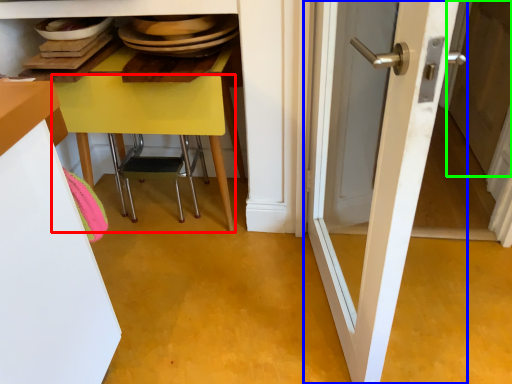
Question: Estimate the real-world distances between objects in this image. Which object is farther from table (highlighted by a red box), door (highlighted by a blue box) or screen door (highlighted by a green box)?

Choices:
 (A) door
 (B) screen door

Answer: (B)